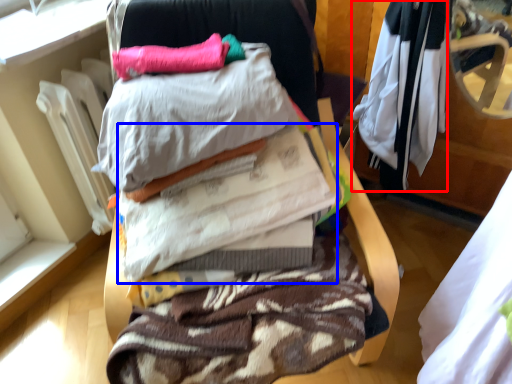
Question: Which of the following is the closest to the observer, clothing (highlighted by a red box) or clothing (highlighted by a blue box)?

Choices:
 (A) clothing
 (B) clothing

Answer: (B)